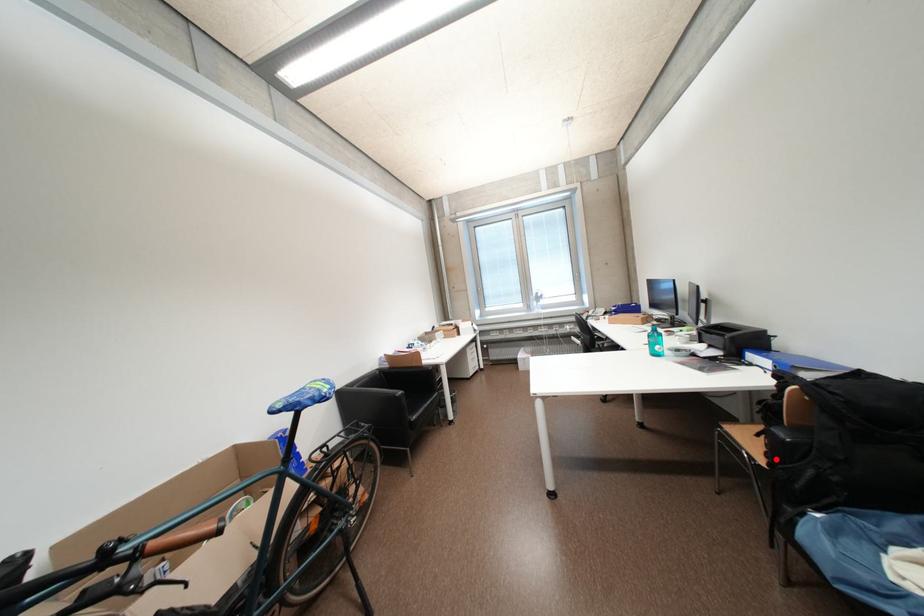
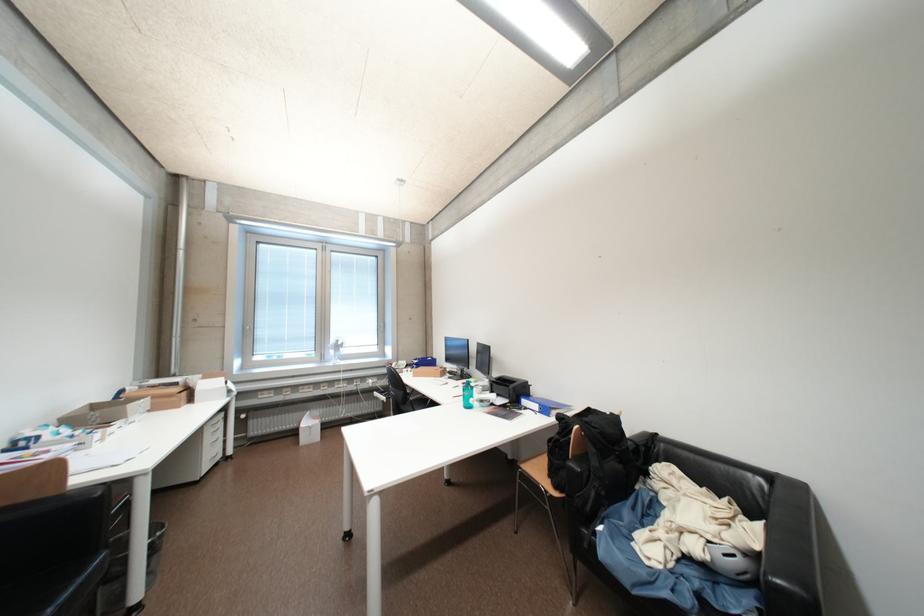
Find the pixel in the second image that matches the highlighted location in the first image.

(564, 488)